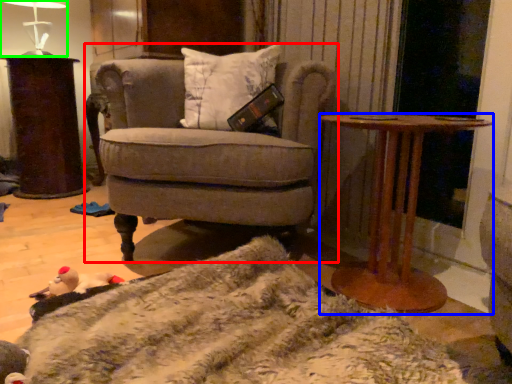
Question: Estimate the real-world distances between objects in this image. Which object is farther from chair (highlighted by a red box), table (highlighted by a blue box) or table lamp (highlighted by a green box)?

Choices:
 (A) table
 (B) table lamp

Answer: (B)